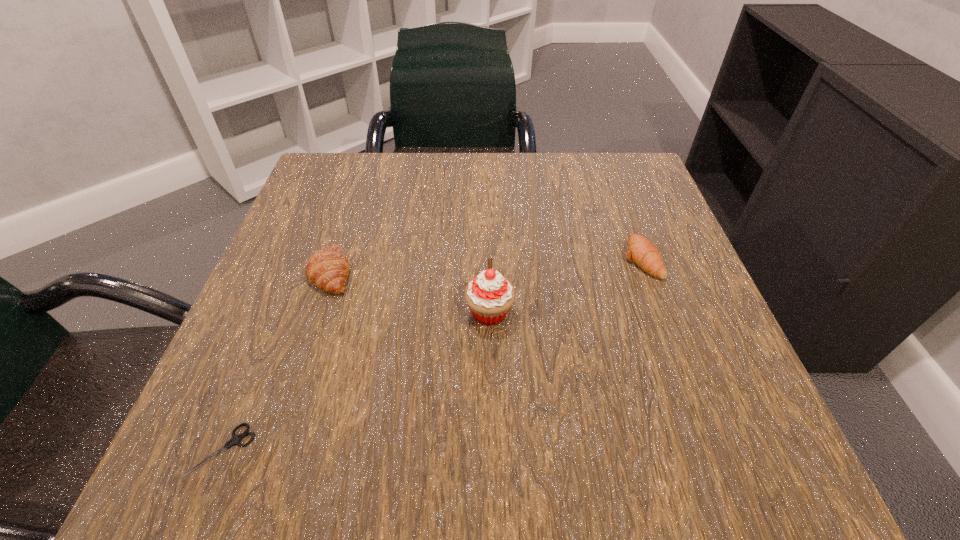
The width and height of the screenshot is (960, 540). In order to click on cupcake in this screenshot , I will do `click(489, 296)`.

At what (x,y) coordinates should I click in order to perform the action: click on the tallest object. Please return your answer as a coordinate pair (x, y). The width and height of the screenshot is (960, 540). Looking at the image, I should click on coord(489,296).

In order to click on the third shortest object in this screenshot , I will do `click(327, 269)`.

Locate an element on the screen. the left crescent roll is located at coordinates [x=327, y=269].

The width and height of the screenshot is (960, 540). Find the location of `the rightmost object`. the rightmost object is located at coordinates (641, 251).

Locate an element on the screen. the shorter crescent roll is located at coordinates (641, 251).

Find the location of `the shortest object`. the shortest object is located at coordinates (235, 439).

Locate an element on the screen. shears is located at coordinates (235, 439).

Locate an element on the screen. This screenshot has height=540, width=960. vacant space situated on the left of the second object from right to left is located at coordinates (307, 313).

Locate an element on the screen. The height and width of the screenshot is (540, 960). vacant space located on the right of the second tallest object is located at coordinates (386, 272).